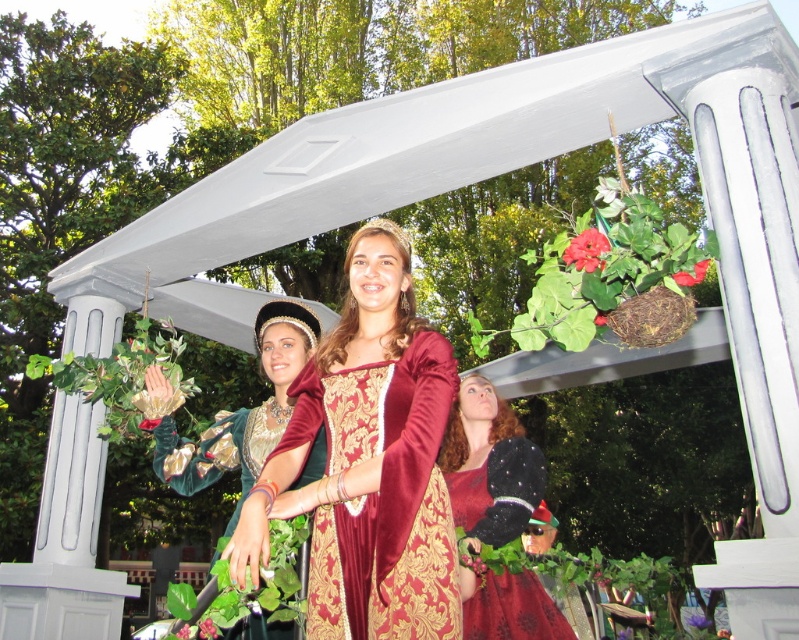
You are standing in front of the medieval costume scene. There are two points marked in the image. The first point is at coordinate point [205,632] and the second point is at coordinate point [181,627]. Which point is closer to you?

Point [205,632] is closer to the viewer than point [181,627].

You are an event planner arranging decorations for a medieval festival. You have a purple matte flower at upper center and a green leafy plant at center. Which decoration is placed to the right of the other?

The purple matte flower at upper center is positioned to the right of the green leafy plant at center.

You are a photographer at the event and want to capture a photo of the purple matte flower at upper center and the green leafy plant at center. Which one is positioned lower in the frame?

The purple matte flower at upper center is positioned below the green leafy plant at center, so the purple matte flower at upper center is lower in the frame.